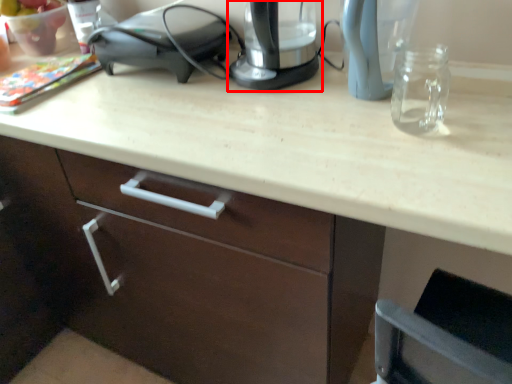
Question: From the image's perspective, what is the correct spatial positioning of home appliance (annotated by the red box) in reference to appliance?

Choices:
 (A) above
 (B) below

Answer: (B)